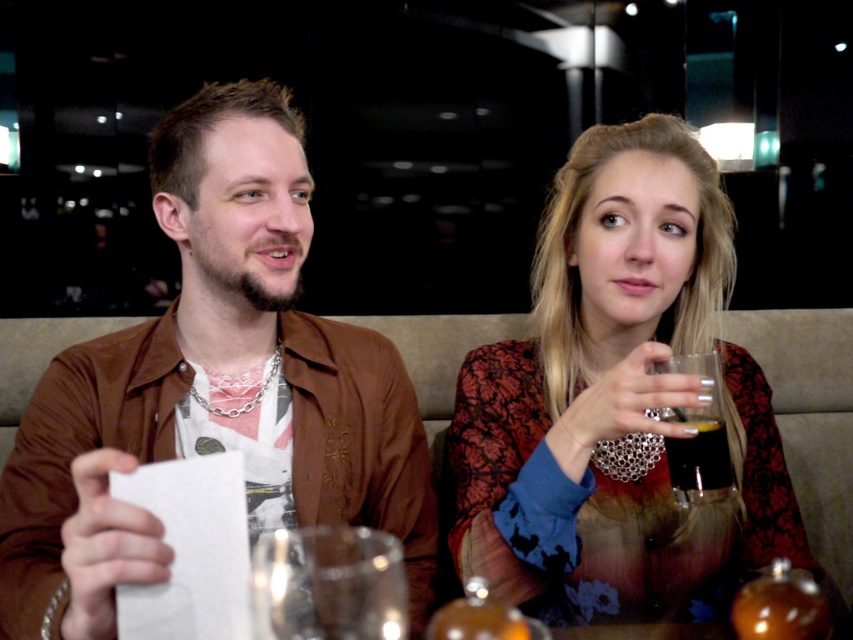
Question: Which object is positioned farthest from the brown leather jacket at center?

Choices:
 (A) matte black dress at center
 (B) transparent glass at lower center

Answer: (A)

Question: Which point appears farthest from the camera in this image?

Choices:
 (A) (404, 636)
 (B) (674, 492)
 (C) (558, 513)
 (D) (383, 449)

Answer: (D)

Question: Which point is farther to the camera?

Choices:
 (A) (241, 218)
 (B) (376, 604)
 (C) (677, 468)
 (D) (700, 582)

Answer: (D)

Question: Is brown leather jacket at center below transparent glass at lower center?

Choices:
 (A) no
 (B) yes

Answer: (A)

Question: Does transparent glass at lower center have a smaller size compared to translucent glass at upper right?

Choices:
 (A) yes
 (B) no

Answer: (B)

Question: Does brown leather jacket at center come in front of matte black dress at center?

Choices:
 (A) yes
 (B) no

Answer: (A)